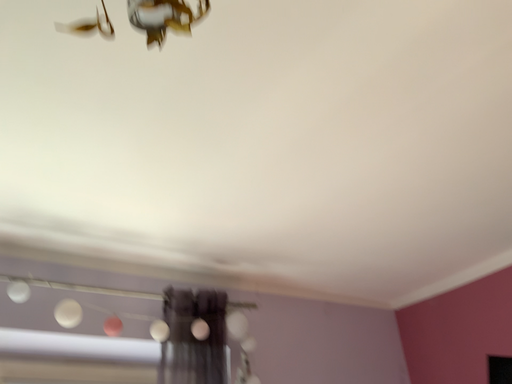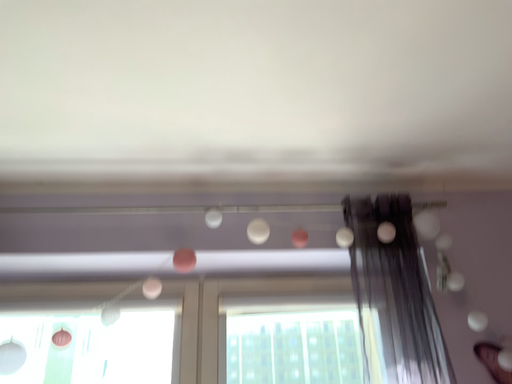
Question: How did the camera likely rotate when shooting the video?

Choices:
 (A) rotated upward
 (B) rotated downward

Answer: (B)